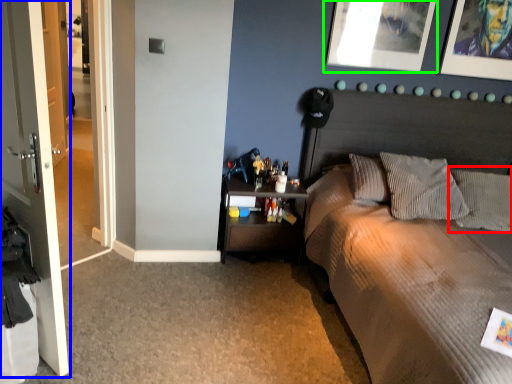
Question: Based on their relative distances, which object is nearer to pillow (highlighted by a red box)? Choose from door (highlighted by a blue box) and picture frame (highlighted by a green box).

Choices:
 (A) door
 (B) picture frame

Answer: (B)